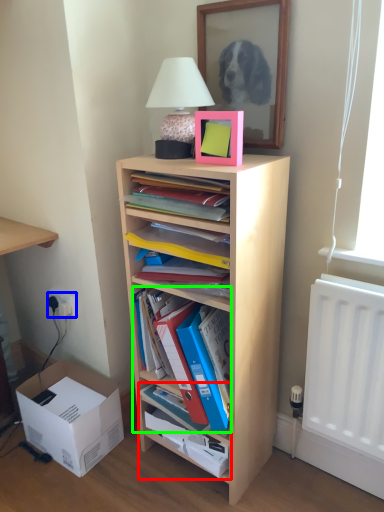
Question: Which is farther away from cabinet (highlighted by a red box)? electric outlet (highlighted by a blue box) or shelf (highlighted by a green box)?

Choices:
 (A) electric outlet
 (B) shelf

Answer: (A)